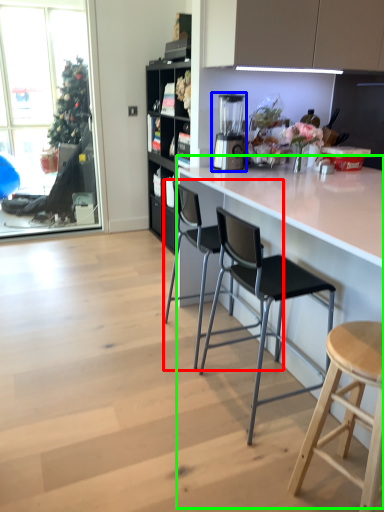
Question: Which object is the farthest from chair (highlighted by a red box)? Choose among these: appliance (highlighted by a blue box) or counter (highlighted by a green box).

Choices:
 (A) appliance
 (B) counter

Answer: (A)